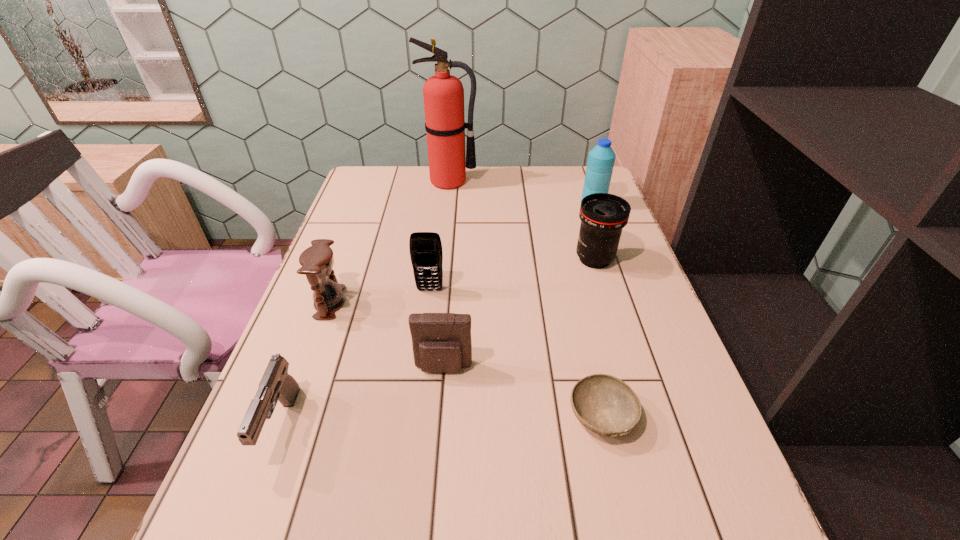
Where is `vacant space located at the nozzle of the tallest object`? Image resolution: width=960 pixels, height=540 pixels. vacant space located at the nozzle of the tallest object is located at coordinates tap(441, 268).

Identify the location of free space located 0.220m on the left of the water bottle. (512, 204).

You are a GUI agent. You are given a task and a screenshot of the screen. Output one action in this format:
    pyautogui.click(x=<x>, y=<y>)
    Task: Click on the free spot located on the screen of the cellular telephone
    
    Given the screenshot: What is the action you would take?
    pyautogui.click(x=418, y=386)

In order to click on vacant space situated 0.140m on the back of the third farthest object in this screenshot , I will do `click(582, 218)`.

This screenshot has height=540, width=960. What are the coordinates of `blank space located 0.150m on the front of the hourglass` in the screenshot? It's located at (303, 374).

Find the location of `free location located with an open flap on the pouch`. free location located with an open flap on the pouch is located at coordinates (436, 464).

Where is `vacant space situated aim along the barrel of the seventh tallest object`? The width and height of the screenshot is (960, 540). vacant space situated aim along the barrel of the seventh tallest object is located at coordinates (254, 501).

This screenshot has width=960, height=540. Identify the location of vacant region located on the right of the shortest object. (672, 416).

Locate an element on the screen. The image size is (960, 540). fire extinguisher situated at the far edge is located at coordinates (443, 94).

At what (x,y) coordinates should I click in order to perform the action: click on water bottle present at the far edge. Please return your answer as a coordinate pair (x, y). Looking at the image, I should click on (601, 159).